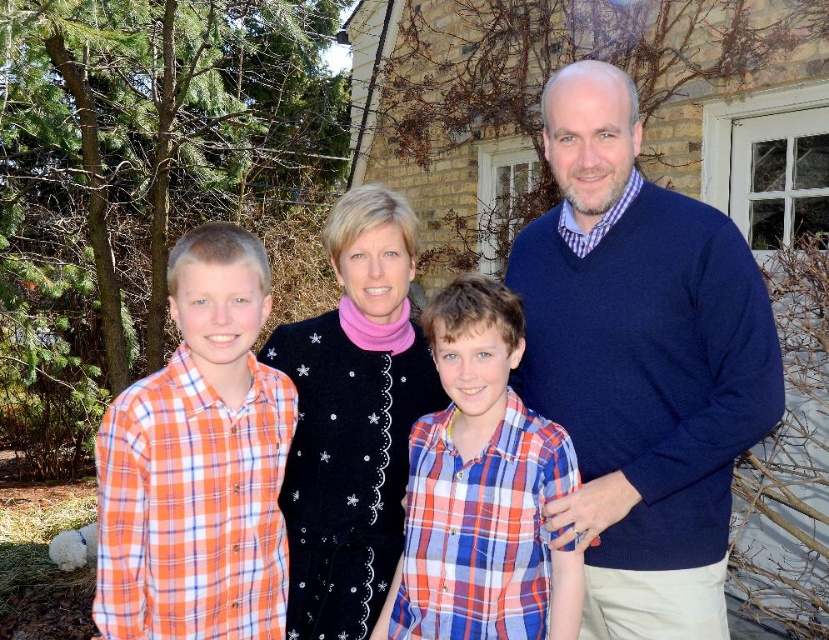
Who is positioned more to the right, navy blue sweater at right or plaid cotton shirt at center?

navy blue sweater at right

At what (x,y) coordinates should I click in order to perform the action: click on navy blue sweater at right. Please return your answer as a coordinate pair (x, y). Looking at the image, I should click on (640, 364).

Between navy blue sweater at right and orange plaid shirt at left, which one appears on the right side from the viewer's perspective?

navy blue sweater at right

Who is shorter, navy blue sweater at right or orange plaid shirt at left?

With less height is orange plaid shirt at left.

Who is more distant from viewer, (611, 259) or (191, 548)?

Point (611, 259)

Where is `navy blue sweater at right`? This screenshot has height=640, width=829. navy blue sweater at right is located at coordinates (640, 364).

Which of these two, navy blue sweater at right or black velvet sweater at center, stands shorter?

black velvet sweater at center is shorter.

Who is more distant from viewer, (617,173) or (348,211)?

The point (348,211) is more distant.

Find the location of `navy blue sweater at right`. navy blue sweater at right is located at coordinates (640, 364).